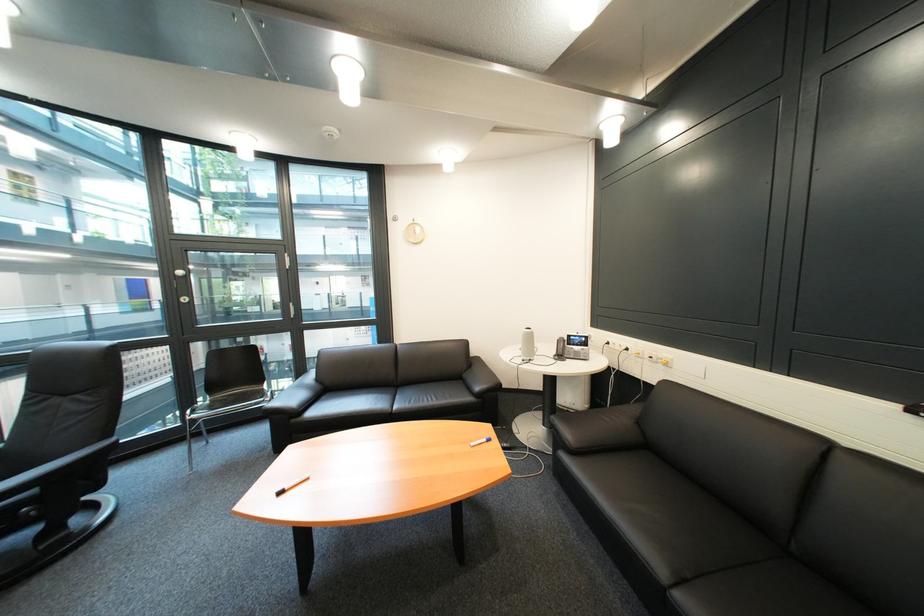
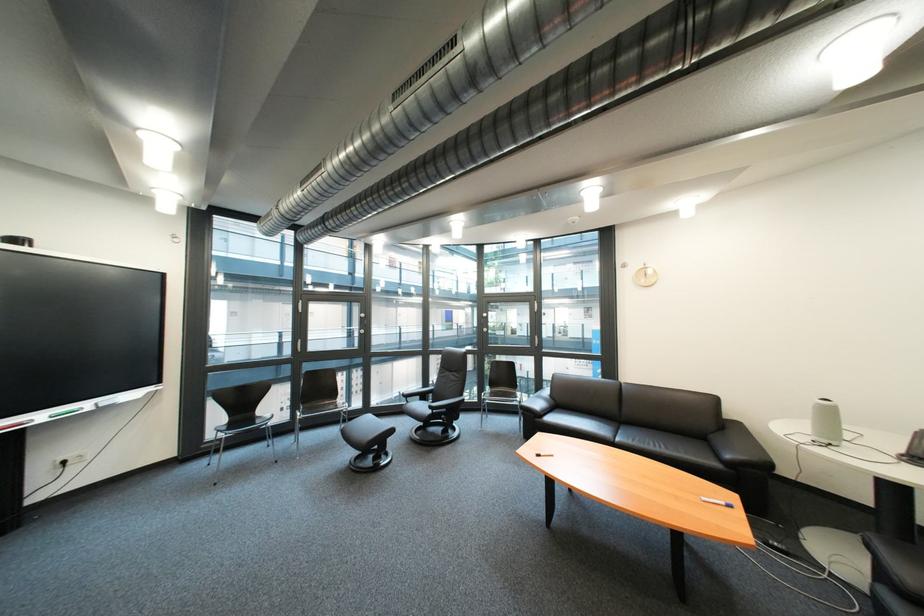
Find the pixel in the second image that matches [491,390] in the first image.

(742, 458)